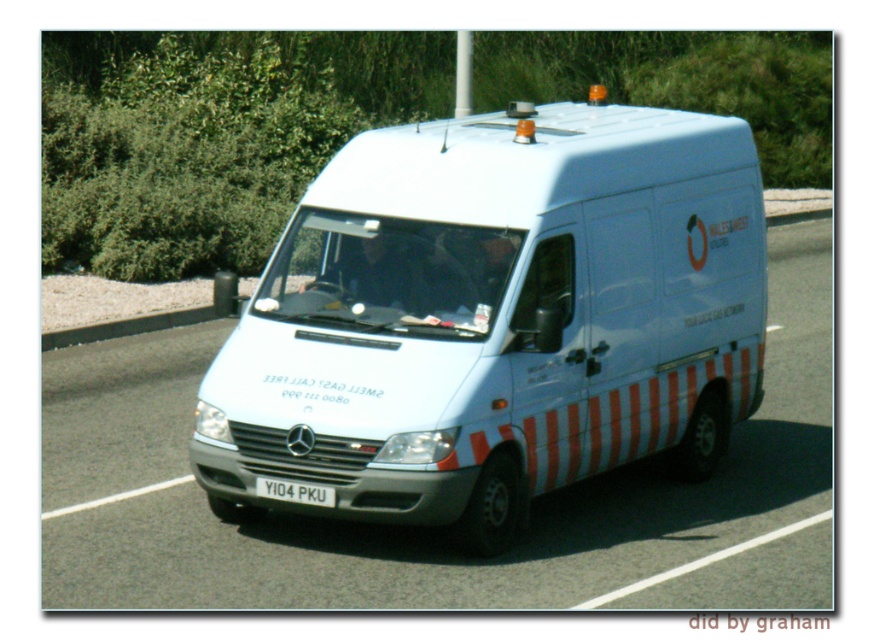
You are standing in front of the white Mercedes Benz Sprinter van parked on the road. You notice two points marked on the van. The first point is at coordinate (302, 467) and the second point is at coordinate (324, 502). From your perspective, which point is closer to you?

Point (324, 502) is closer to you because it is in front of point (302, 467).

You are a pedestrian standing on the sidewalk next to the road where the white glossy van at center and the black plastic license plate at center are located. From your perspective, which object is positioned to the right?

The white glossy van at center is positioned to the right of the black plastic license plate at center.

You are a pedestrian standing on the sidewalk looking at the white glossy van at center and the black plastic license plate at center. Which object is positioned higher from the ground?

The white glossy van at center is positioned higher from the ground than the black plastic license plate at center.